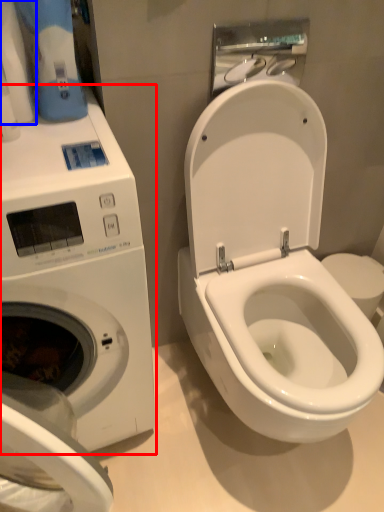
Question: Which object appears closest to the camera in this image, washing machine (highlighted by a red box) or toilet paper (highlighted by a blue box)?

Choices:
 (A) washing machine
 (B) toilet paper

Answer: (A)